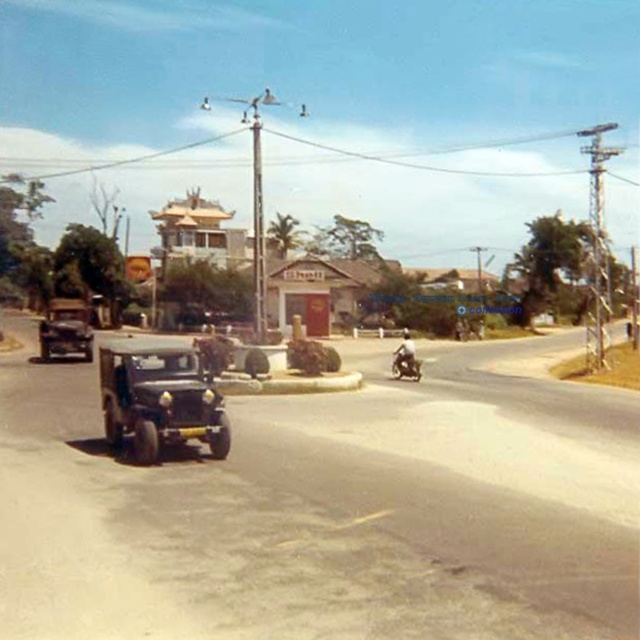
Question: Based on their relative distances, which object is nearer to the metallic silver motorcycle at center?

Choices:
 (A) shiny black car at left
 (B) wooden temple at center

Answer: (A)

Question: Is wooden temple at center thinner than metallic silver motorcycle at center?

Choices:
 (A) yes
 (B) no

Answer: (B)

Question: Estimate the real-world distances between objects in this image. Which object is farther from the wooden temple at center?

Choices:
 (A) shiny black car at left
 (B) shiny black motorcycle at center
 (C) metallic silver motorcycle at center
 (D) shiny black car at center

Answer: (B)

Question: Does shiny black car at left appear on the right side of shiny black motorcycle at center?

Choices:
 (A) no
 (B) yes

Answer: (A)

Question: Which of these objects is positioned farthest from the shiny black car at left?

Choices:
 (A) shiny black car at center
 (B) metallic silver motorcycle at center
 (C) wooden temple at center

Answer: (C)

Question: Considering the relative positions of wooden temple at center and shiny black car at left in the image provided, where is wooden temple at center located with respect to shiny black car at left?

Choices:
 (A) above
 (B) below

Answer: (A)